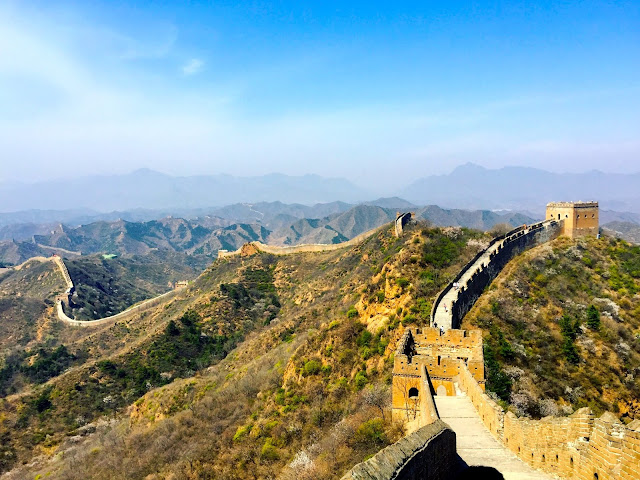
In order to click on windows in this screenshot , I will do `click(410, 392)`, `click(579, 214)`, `click(586, 214)`.